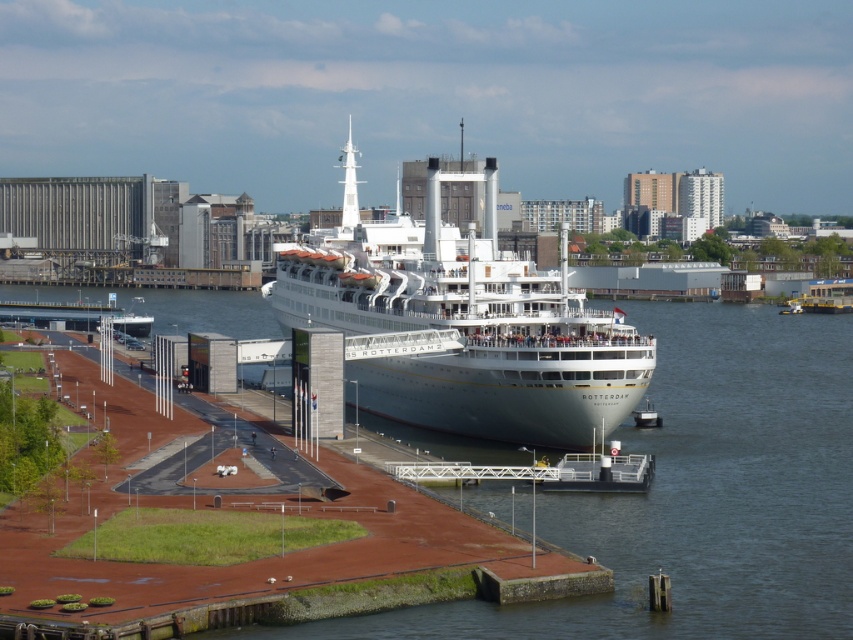
You are a photographer planning to take a photo of the white glossy cruise ship at center and the clear water at center from the pier. Based on the scene description, which object will occupy more space in your photo?

The clear water at center is larger in size than the white glossy cruise ship at center, so it will occupy more space in the photo.

You are a photographer standing on the pier and want to take a photo of both the white glossy cruise ship at center and the white glossy boat at lower left. Which one will appear larger in the photo?

The white glossy cruise ship at center will appear larger in the photo because it is closer to you than the white glossy boat at lower left.